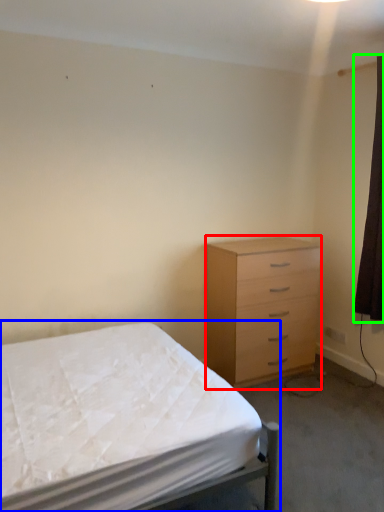
Question: Which object is the farthest from chest of drawers (highlighted by a red box)? Choose among these: bed (highlighted by a blue box) or curtain (highlighted by a green box).

Choices:
 (A) bed
 (B) curtain

Answer: (A)